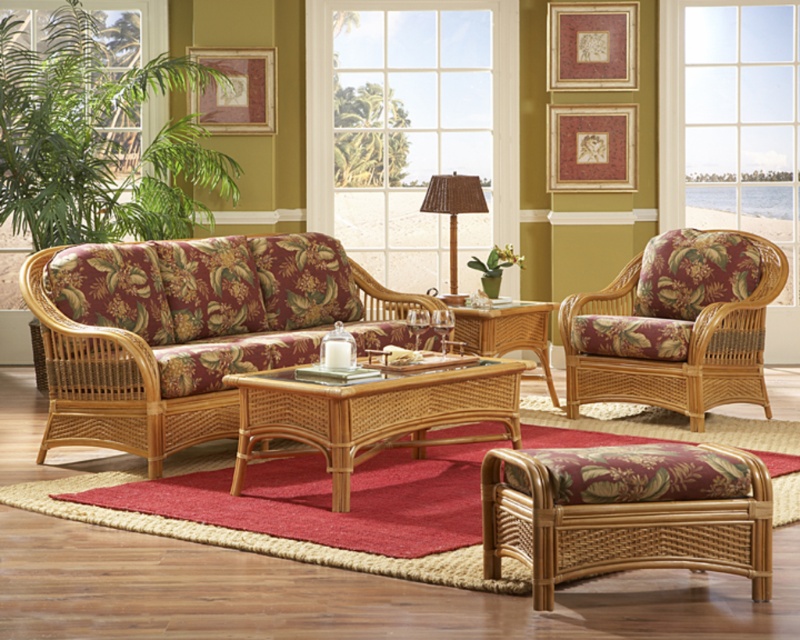
Is green leafy plant at upper left wider than rattan wicker coffee table at center?

Indeed, green leafy plant at upper left has a greater width compared to rattan wicker coffee table at center.

Is green leafy plant at upper left closer to camera compared to rattan wicker coffee table at center?

No, green leafy plant at upper left is behind rattan wicker coffee table at center.

What do you see at coordinates (96, 140) in the screenshot?
I see `green leafy plant at upper left` at bounding box center [96, 140].

The width and height of the screenshot is (800, 640). I want to click on green leafy plant at upper left, so click(x=96, y=140).

Is woven rattan armchair at right wider than rattan/wooden coffee table at center?

No, woven rattan armchair at right is not wider than rattan/wooden coffee table at center.

What do you see at coordinates (676, 324) in the screenshot? I see `woven rattan armchair at right` at bounding box center [676, 324].

Locate an element on the screen. woven rattan armchair at right is located at coordinates (676, 324).

How much distance is there between green leafy plant at upper left and green matte pot at center?

green leafy plant at upper left is 3.42 meters away from green matte pot at center.

Who is positioned more to the left, green leafy plant at upper left or green matte pot at center?

green leafy plant at upper left is more to the left.

Who is more distant from viewer, [130,67] or [496,280]?

The point [130,67] is behind.

Locate an element on the screen. The height and width of the screenshot is (640, 800). green leafy plant at upper left is located at coordinates (96, 140).